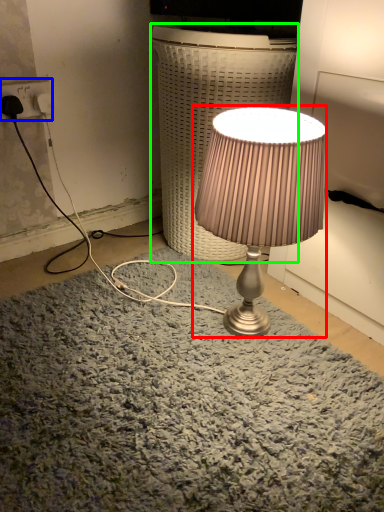
Question: Estimate the real-world distances between objects in this image. Which object is farther from lamp (highlighted by a red box), electric outlet (highlighted by a blue box) or table (highlighted by a green box)?

Choices:
 (A) electric outlet
 (B) table

Answer: (A)